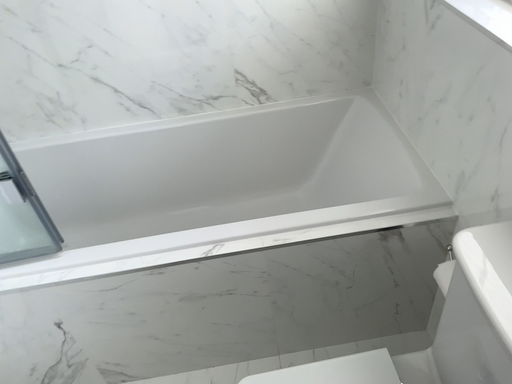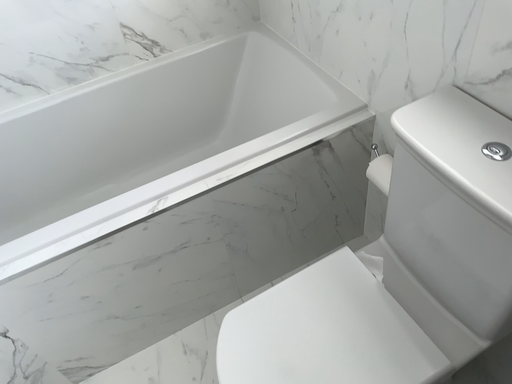
Question: Which way did the camera rotate in the video?

Choices:
 (A) rotated left
 (B) rotated right

Answer: (B)